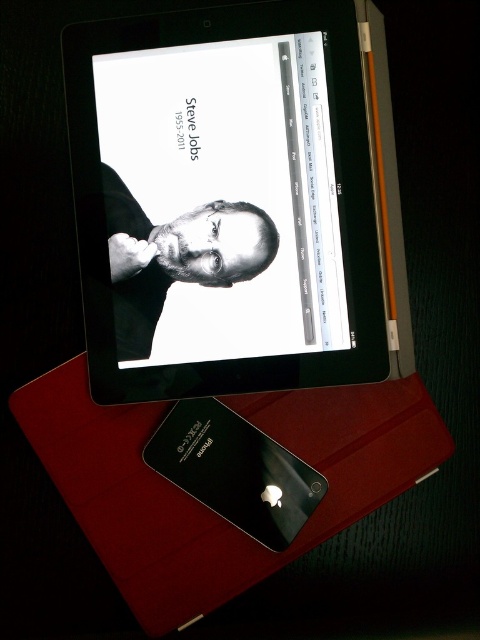
Between black glossy tablet at upper center and black matte portrait at center, which one has more height?

Standing taller between the two is black glossy tablet at upper center.

Who is more forward, (240, 13) or (230, 216)?

Positioned in front is point (240, 13).

Where is `black glossy tablet at upper center`? The width and height of the screenshot is (480, 640). black glossy tablet at upper center is located at coordinates (226, 198).

Where is `black glossy tablet at upper center`? black glossy tablet at upper center is located at coordinates (226, 198).

Looking at this image, can you confirm if black glossy tablet at upper center is taller than black glossy tablet at center?

Indeed, black glossy tablet at upper center has a greater height compared to black glossy tablet at center.

The height and width of the screenshot is (640, 480). What do you see at coordinates (226, 198) in the screenshot?
I see `black glossy tablet at upper center` at bounding box center [226, 198].

This screenshot has width=480, height=640. I want to click on black glossy tablet at upper center, so click(x=226, y=198).

How far apart are black matte portrait at center and black glossy tablet at center?

black matte portrait at center is 9.89 inches away from black glossy tablet at center.

Does black matte portrait at center come behind black glossy tablet at center?

Yes.

At what (x,y) coordinates should I click in order to perform the action: click on black matte portrait at center. Please return your answer as a coordinate pair (x, y). The width and height of the screenshot is (480, 640). Looking at the image, I should click on 176,257.